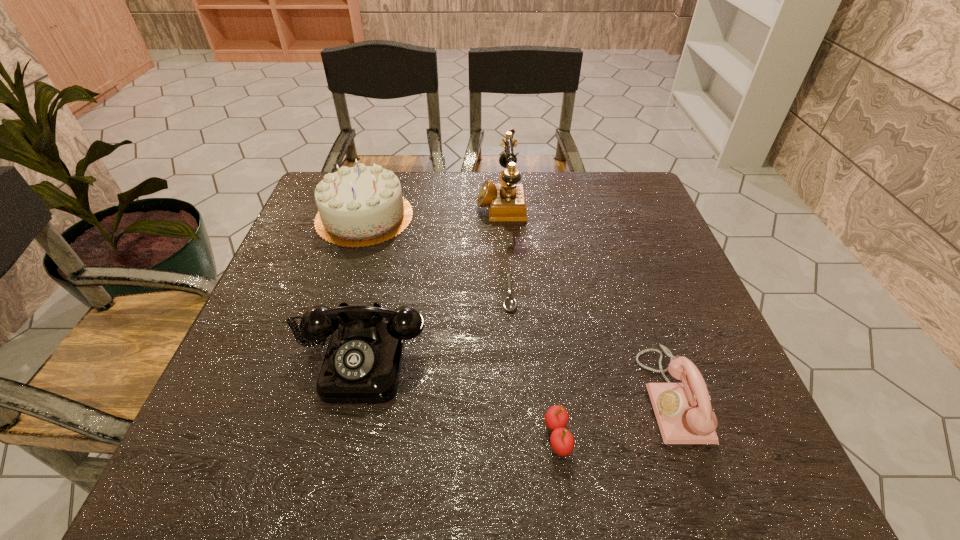
At what (x,y) coordinates should I click in order to perform the action: click on vacant space located 0.080m on the dial number of the farthest telephone. Please return your answer as a coordinate pair (x, y). Looking at the image, I should click on (448, 202).

I want to click on free space located 0.330m on the front of the fifth shortest object, so click(320, 356).

Locate an element on the screen. blank space located on the dial of the leftmost telephone is located at coordinates (337, 459).

Where is `vacant area situated 0.390m on the dial of the rightmost object`? The width and height of the screenshot is (960, 540). vacant area situated 0.390m on the dial of the rightmost object is located at coordinates (433, 395).

Find the location of a particular element. The image size is (960, 540). vacant region located 0.350m on the dial of the rightmost object is located at coordinates (455, 395).

I want to click on vacant space located on the dial of the rightmost object, so click(597, 395).

Where is `vacant space located 0.260m on the left of the fifth tallest object`? vacant space located 0.260m on the left of the fifth tallest object is located at coordinates (393, 436).

The image size is (960, 540). I want to click on vacant space located 0.260m on the right of the third farthest object, so pos(632,294).

I want to click on telephone that is at the far edge, so click(x=506, y=201).

Find the location of a particular element. birthday cake located in the far edge section of the desktop is located at coordinates (360, 206).